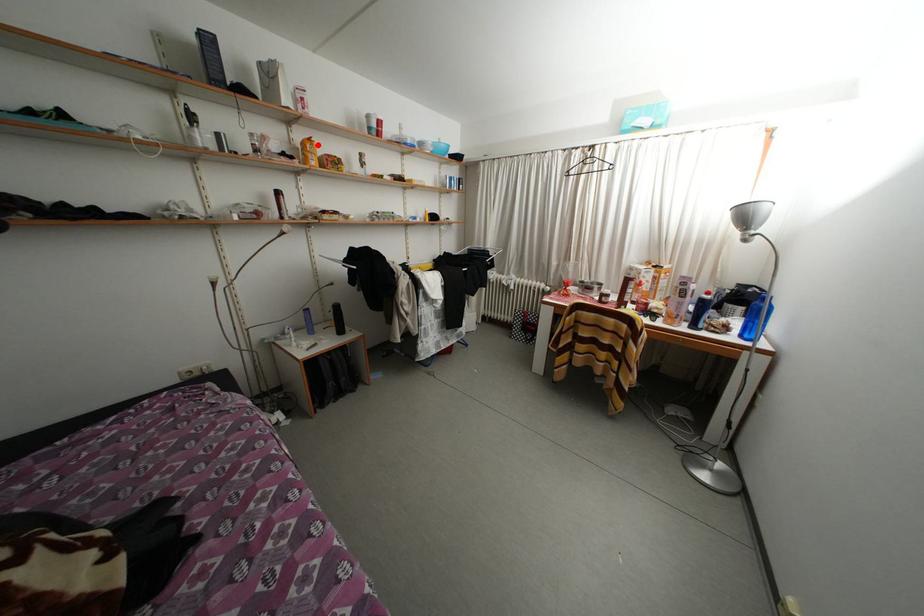
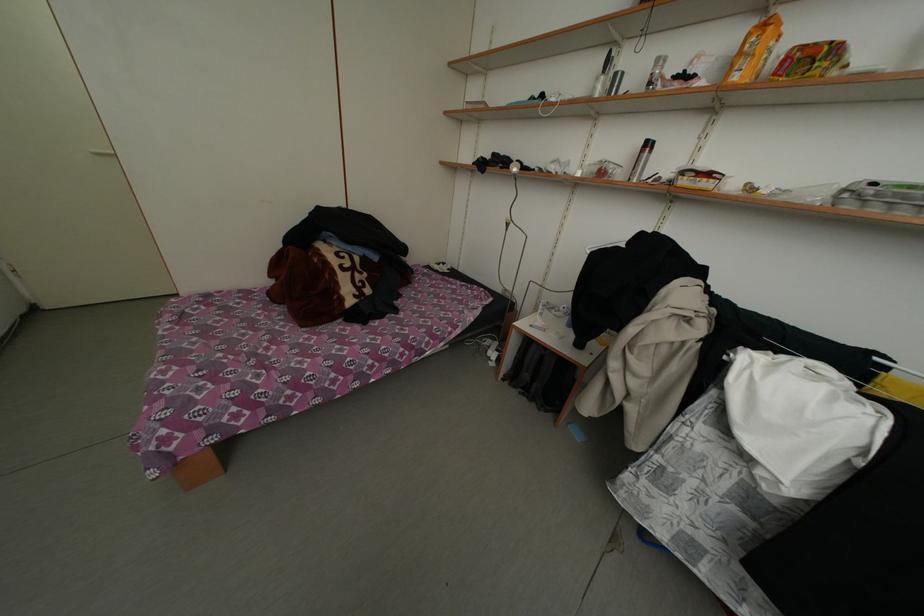
The point at the highlighted location is marked in the first image. Where is the corresponding point in the second image?

(774, 29)